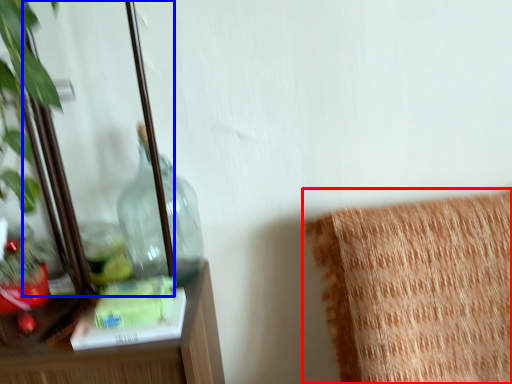
Question: Among these objects, which one is farthest to the camera, furniture (highlighted by a red box) or mirror (highlighted by a blue box)?

Choices:
 (A) furniture
 (B) mirror

Answer: (A)